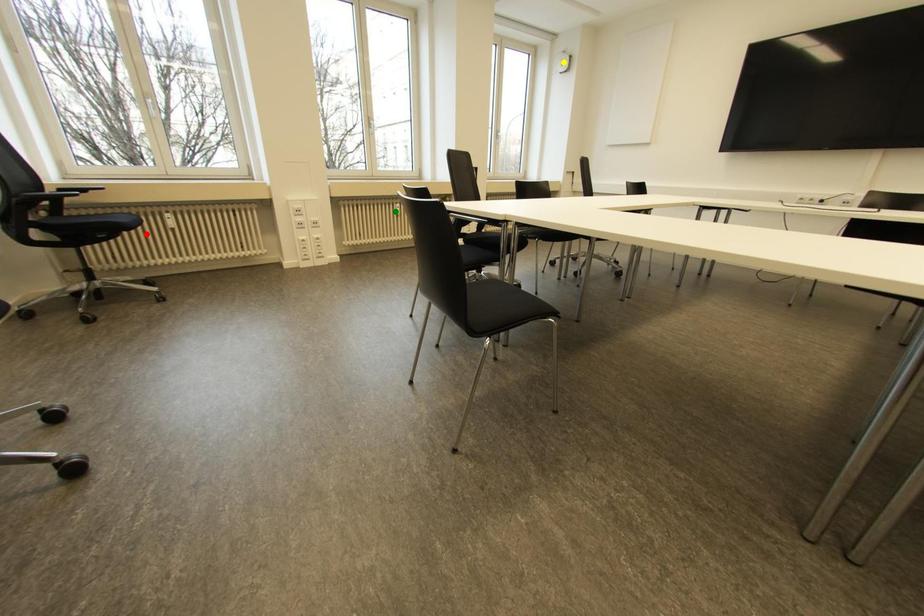
Order these from nearest to farthest:
red point | green point | yellow point

1. red point
2. green point
3. yellow point